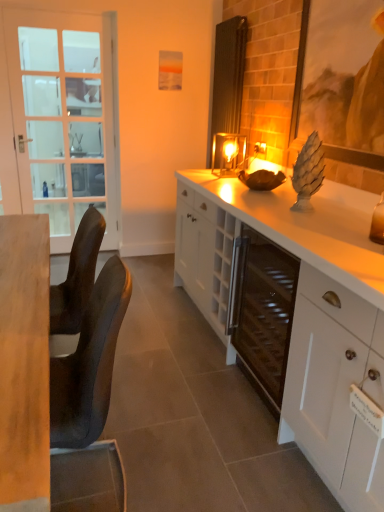
Question: Can you confirm if white glossy cabinet at center is shorter than metallic glass candle holder at center?

Choices:
 (A) no
 (B) yes

Answer: (A)

Question: Is white glossy cabinet at center turned away from metallic glass candle holder at center?

Choices:
 (A) no
 (B) yes

Answer: (A)

Question: From a real-world perspective, is white glossy cabinet at center on top of metallic glass candle holder at center?

Choices:
 (A) no
 (B) yes

Answer: (A)

Question: Considering the relative sizes of white glossy cabinet at center and metallic glass candle holder at center in the image provided, is white glossy cabinet at center bigger than metallic glass candle holder at center?

Choices:
 (A) no
 (B) yes

Answer: (B)

Question: Does white glossy cabinet at center lie in front of metallic glass candle holder at center?

Choices:
 (A) no
 (B) yes

Answer: (B)

Question: From the image's perspective, is white glossy cabinet at center below metallic glass candle holder at center?

Choices:
 (A) no
 (B) yes

Answer: (B)

Question: Can you confirm if metallic glass candle holder at center is positioned to the right of black leather chair at left?

Choices:
 (A) no
 (B) yes

Answer: (B)

Question: From a real-world perspective, is metallic glass candle holder at center over black leather chair at left?

Choices:
 (A) no
 (B) yes

Answer: (B)

Question: Is metallic glass candle holder at center bigger than black leather chair at left?

Choices:
 (A) yes
 (B) no

Answer: (B)

Question: Does metallic glass candle holder at center turn towards black leather chair at left?

Choices:
 (A) no
 (B) yes

Answer: (A)

Question: Are metallic glass candle holder at center and black leather chair at left located far from each other?

Choices:
 (A) no
 (B) yes

Answer: (B)

Question: Does metallic glass candle holder at center appear on the left side of black leather chair at left?

Choices:
 (A) yes
 (B) no

Answer: (B)

Question: From the image's perspective, does white glass screen door at left appear higher than white glossy cabinet at center?

Choices:
 (A) no
 (B) yes

Answer: (B)